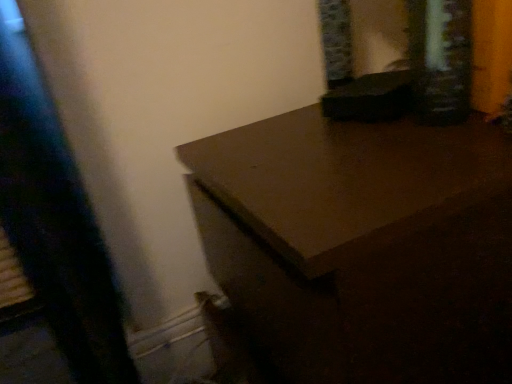
Find the location of a particular element. free space above matte brown table at lower right (from a real-world perspective) is located at coordinates (342, 147).